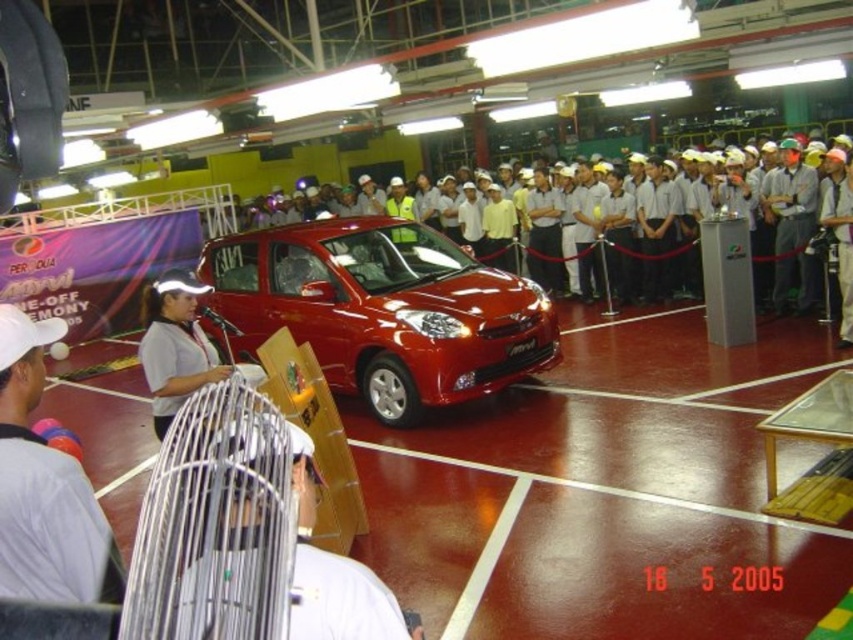
Between white fabric cap at center and white fabric shirt at center, which one appears on the left side from the viewer's perspective?

white fabric shirt at center

Does white fabric cap at center appear over white fabric shirt at center?

No, white fabric cap at center is not above white fabric shirt at center.

The width and height of the screenshot is (853, 640). I want to click on white fabric cap at center, so click(44, 486).

Is glossy red car at center thinner than white hard hats at center?

No, glossy red car at center is not thinner than white hard hats at center.

Who is lower down, glossy red car at center or white hard hats at center?

glossy red car at center is lower down.

Does point (453, 312) come farther from viewer compared to point (244, 157)?

No, it is not.

I want to click on glossy red car at center, so click(381, 308).

Where is `white fabric fan at center`? The height and width of the screenshot is (640, 853). white fabric fan at center is located at coordinates (334, 573).

Is white fabric fan at center positioned in front of white fabric shirt at center?

Yes, it is.

Consider the image. Measure the distance between white fabric fan at center and camera.

A distance of 1.30 meters exists between white fabric fan at center and camera.

The image size is (853, 640). I want to click on white fabric fan at center, so click(334, 573).